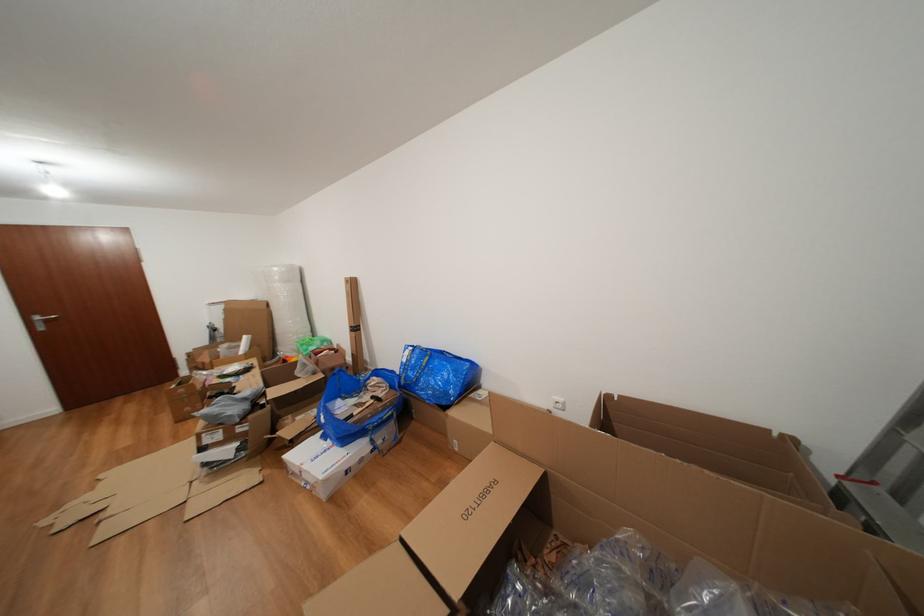
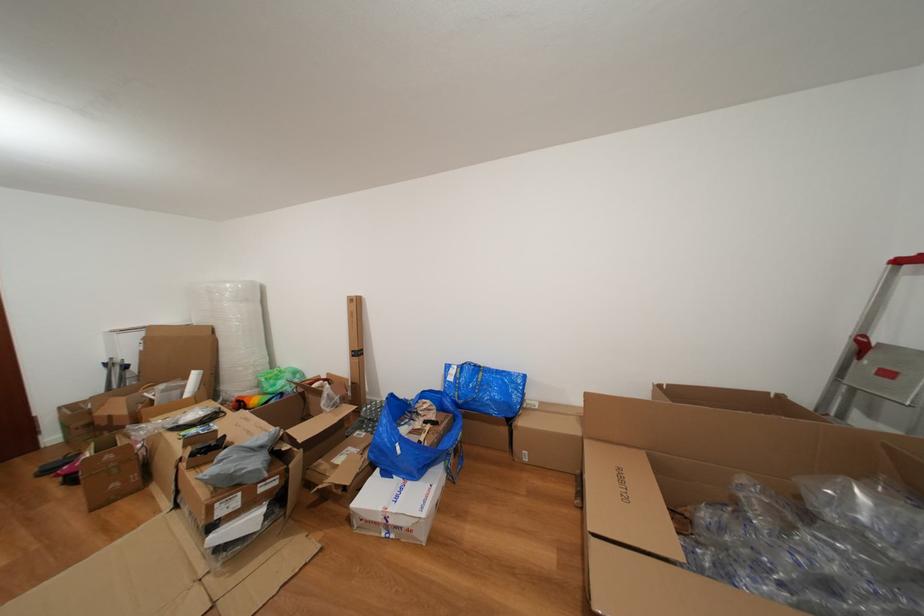
Locate, in the second image, the point that corresponds to [314,355] in the first image.

(283, 390)